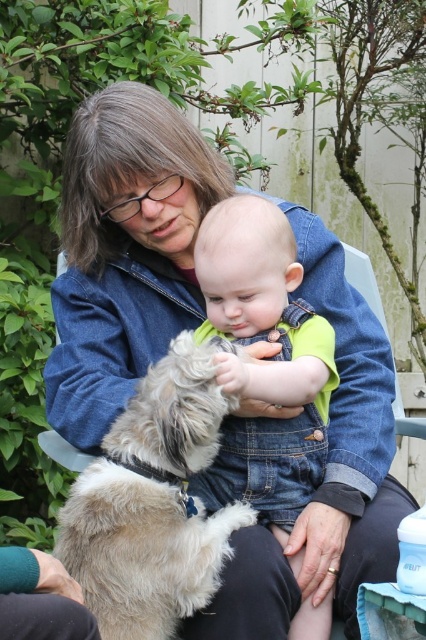
You are standing in the backyard and see the fuzzy beige dog at center. There is a point marked at coordinates [152,502]. Is this point located on the fuzzy beige dog at center?

Yes, the point marked at coordinates [152,502] is located on the fuzzy beige dog at center.

You are taking a photo of the scene and want to focus on both point (186, 339) and point (195, 250). Which point should you focus on first to ensure both are in focus?

Point (186, 339) is closer to the camera than point (195, 250), so focus on point (186, 339) first to ensure both points are in focus.

You are a photographer trying to capture a candid shot of the baby and the dog. Since the fuzzy beige dog at center is shorter than the denim overalls at center, where should you position your camera to ensure both the baby and the dog are clearly visible in the frame?

Since the fuzzy beige dog at center is shorter than the denim overalls at center, you should position your camera at a lower angle to capture the baby sitting in the denim overalls at center while still including the fuzzy beige dog at center in the foreground.